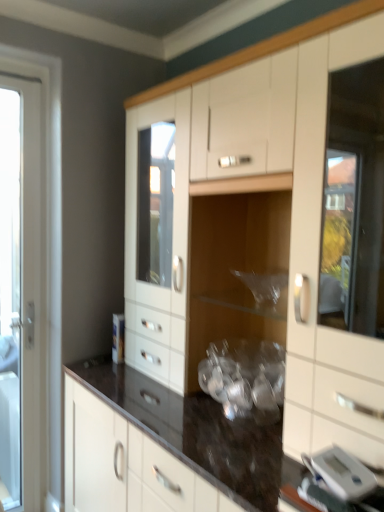
Question: Should I look upward or downward to see silver metallic digital clock at lower right?

Choices:
 (A) down
 (B) up

Answer: (A)

Question: From a real-world perspective, is silver metallic digital clock at lower right below white glossy door at left?

Choices:
 (A) no
 (B) yes

Answer: (B)

Question: From a real-world perspective, is silver metallic digital clock at lower right located higher than white glossy door at left?

Choices:
 (A) yes
 (B) no

Answer: (B)

Question: Can you confirm if silver metallic digital clock at lower right is smaller than white glossy door at left?

Choices:
 (A) no
 (B) yes

Answer: (B)

Question: Is silver metallic digital clock at lower right outside of white glossy door at left?

Choices:
 (A) no
 (B) yes

Answer: (B)

Question: Can you confirm if silver metallic digital clock at lower right is wider than white glossy door at left?

Choices:
 (A) yes
 (B) no

Answer: (A)

Question: Is silver metallic digital clock at lower right in contact with white glossy door at left?

Choices:
 (A) yes
 (B) no

Answer: (B)

Question: Is white glossy door at left smaller than white glossy cabinet at center?

Choices:
 (A) yes
 (B) no

Answer: (A)

Question: Considering the relative sizes of white glossy door at left and white glossy cabinet at center in the image provided, is white glossy door at left wider than white glossy cabinet at center?

Choices:
 (A) no
 (B) yes

Answer: (A)

Question: Is white glossy cabinet at center at the back of white glossy door at left?

Choices:
 (A) yes
 (B) no

Answer: (B)

Question: Is white glossy door at left to the left of white glossy cabinet at center from the viewer's perspective?

Choices:
 (A) no
 (B) yes

Answer: (B)

Question: Can you confirm if white glossy door at left is thinner than white glossy cabinet at center?

Choices:
 (A) no
 (B) yes

Answer: (B)

Question: Is white glossy door at left positioned before white glossy cabinet at center?

Choices:
 (A) yes
 (B) no

Answer: (B)

Question: Does white glossy door at left appear on the left side of silver metallic digital clock at lower right?

Choices:
 (A) no
 (B) yes

Answer: (B)